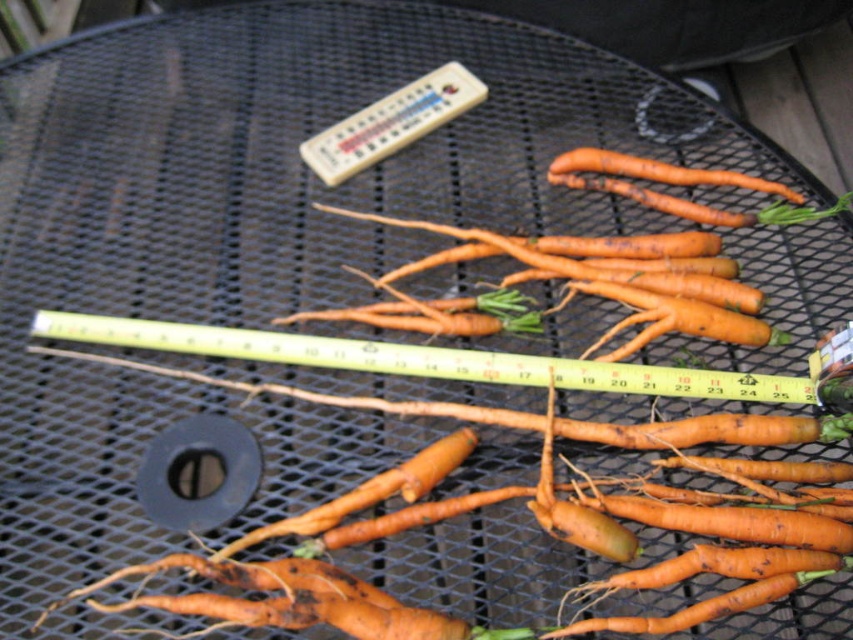
Does yellow plastic ruler at center appear over orange matte carrot at center?

Actually, yellow plastic ruler at center is below orange matte carrot at center.

Does yellow plastic ruler at center have a lesser width compared to orange matte carrot at center?

No.

What do you see at coordinates (421, 358) in the screenshot? I see `yellow plastic ruler at center` at bounding box center [421, 358].

Identify the location of yellow plastic ruler at center. This screenshot has width=853, height=640. (421, 358).

What do you see at coordinates (421, 358) in the screenshot? I see `yellow plastic ruler at center` at bounding box center [421, 358].

Locate an element on the screen. yellow plastic ruler at center is located at coordinates (421, 358).

At what (x,y) coordinates should I click in order to perform the action: click on yellow plastic ruler at center. Please return your answer as a coordinate pair (x, y). Image resolution: width=853 pixels, height=640 pixels. Looking at the image, I should click on pos(421,358).

Which of these two, orange matte carrot at center or orange rough skin at upper center, stands taller?

Standing taller between the two is orange matte carrot at center.

Measure the distance between orange matte carrot at center and camera.

The distance of orange matte carrot at center from camera is 33.03 inches.

This screenshot has height=640, width=853. Identify the location of orange matte carrot at center. coord(616,280).